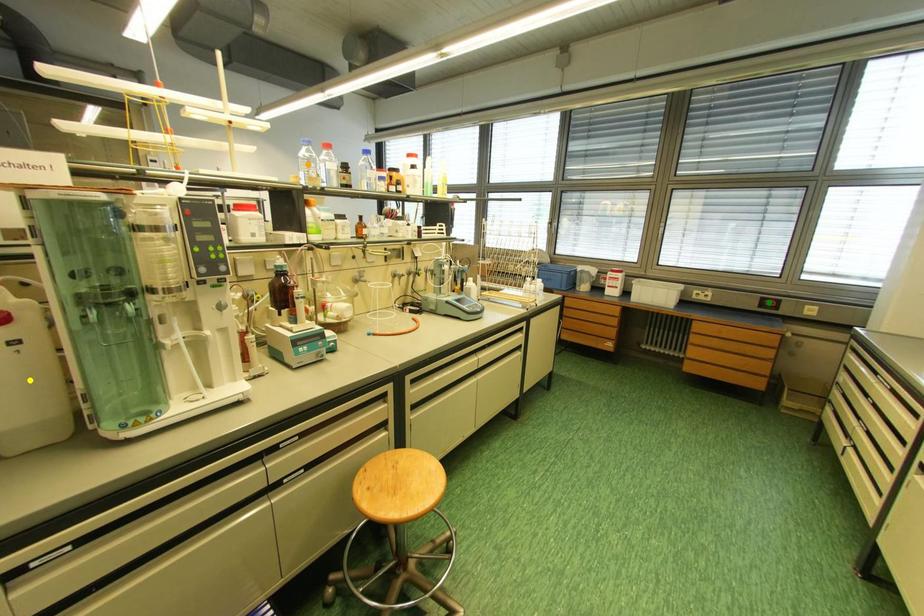
Order these from farthest to nearest:
yellow point | orange point | green point

green point → orange point → yellow point